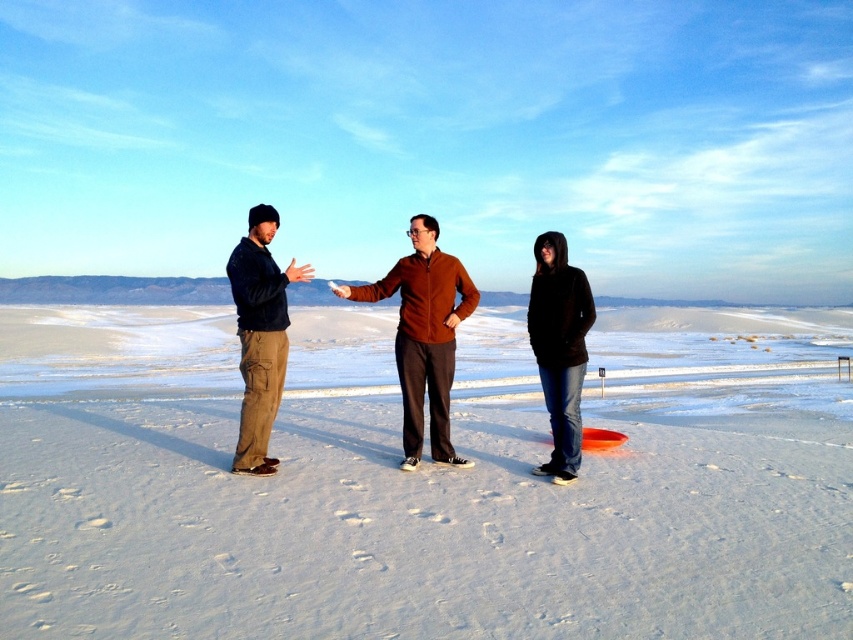
Which of these two, white sandy beach at center or black matte hoodie at lower right, stands taller?

black matte hoodie at lower right

Where is `white sandy beach at center`? white sandy beach at center is located at coordinates pyautogui.click(x=416, y=529).

Which is in front, point (68, 481) or point (579, 278)?

Point (68, 481)

This screenshot has width=853, height=640. What are the coordinates of `white sandy beach at center` in the screenshot? It's located at pyautogui.click(x=416, y=529).

From the picture: Who is higher up, matte black jacket at left or black matte hoodie at lower right?

Positioned higher is matte black jacket at left.

Can you confirm if matte black jacket at left is taller than black matte hoodie at lower right?

Yes.

Who is more distant from viewer, (238, 291) or (569, 448)?

Positioned behind is point (569, 448).

At what (x,y) coordinates should I click in order to perform the action: click on matte black jacket at left. Please return your answer as a coordinate pair (x, y). Looking at the image, I should click on (260, 336).

Is white sandy beach at center thinner than matte black jacket at left?

Yes, white sandy beach at center is thinner than matte black jacket at left.

Can you confirm if white sandy beach at center is shorter than matte black jacket at left?

Yes.

Does point (293, 596) come closer to viewer compared to point (245, 448)?

Yes, it is in front of point (245, 448).

The image size is (853, 640). What are the coordinates of `white sandy beach at center` in the screenshot? It's located at (416, 529).